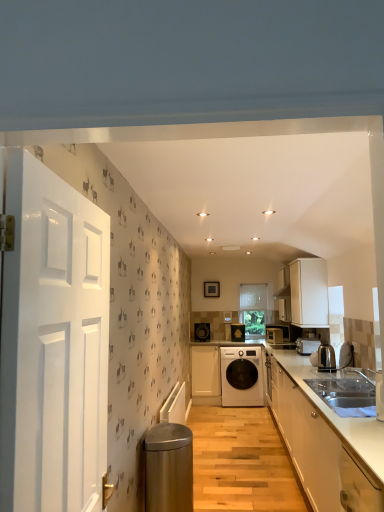
Question: Is point (243, 399) closer or farther from the camera than point (299, 330)?

Choices:
 (A) farther
 (B) closer

Answer: (A)

Question: Considering the positions of white glossy washing machine at center and matte black microwave at center, marked as the third kitchen appliance in a front-to-back arrangement, in the image, is white glossy washing machine at center taller or shorter than matte black microwave at center, marked as the third kitchen appliance in a front-to-back arrangement,?

Choices:
 (A) short
 (B) tall

Answer: (B)

Question: Which of these objects is positioned farthest from the white fabric at center?

Choices:
 (A) white glossy cabinets at lower right, which is counted as the first cabinetry, starting from the front
 (B) matte black microwave at center, the first kitchen appliance from the back
 (C) shiny metallic kettle at right, the 3th kitchen appliance from the back
 (D) matte black speaker at center, arranged as the third appliance when viewed from the right
 (E) white glossy washing machine at center, the second appliance positioned from the left

Answer: (A)

Question: Which of these objects is positioned closest to the matte black microwave at center, the first kitchen appliance from the back?

Choices:
 (A) shiny metallic kettle at right, the first kitchen appliance when ordered from front to back
 (B) white fabric at center
 (C) white glossy door at left
 (D) white glossy washing machine at center
 (E) white glossy washing machine at center, arranged as the second appliance when viewed from the right

Answer: (B)